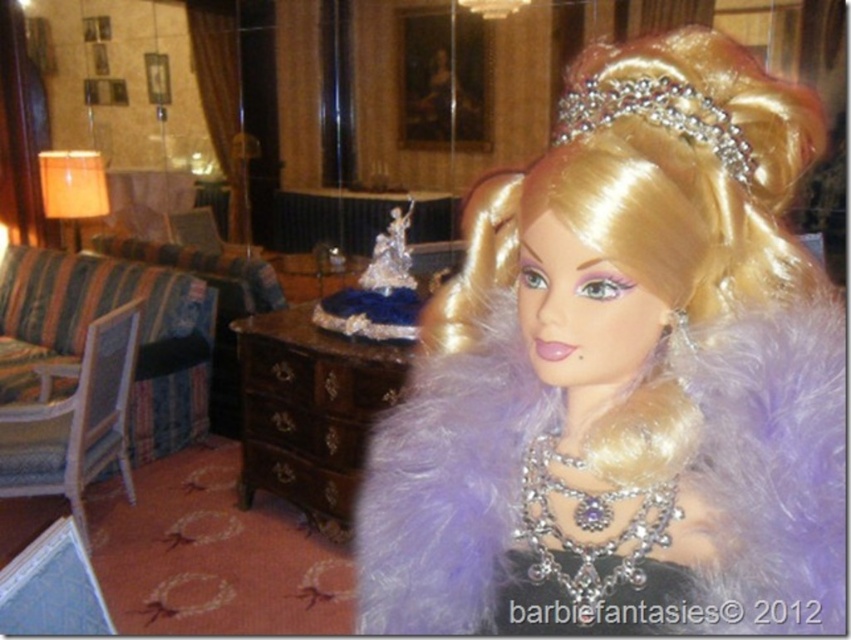
You are standing in the luxurious interior setting where the doll is displayed. There are two points marked in the image. The first point is at coordinates point (647, 317) and the second point is at point (660, 120). If you were to walk from the first point to the second point, would you be moving towards the doll or away from it?

Since point (647, 317) is behind point (660, 120), moving from the first point to the second point would mean moving towards the doll.

Consider the image. You are a guest at a party and need to sit down. You see a white wood armchair at left and a diamond encrusted tiara at upper center. Which object can you sit on?

The white wood armchair at left can be sat on, while the diamond encrusted tiara at upper center is an accessory and not meant for sitting. The white wood armchair at left is also wider than the tiara, making it suitable for sitting.

You are a photographer setting up a shoot in the room. You need to position a 1.2 meter tall light stand between the silky blonde wig at upper center and the white wood armchair at left. Can the light stand fit vertically between them without touching either object?

The silky blonde wig at upper center is not as tall as the white wood armchair at left, so the tallest object between them is the white wood armchair at left. Since the light stand is 1.2 meters tall, it can be placed vertically between them as long as the height of the white wood armchair at left is at least 1.2 meters. However, without knowing the exact height of the armchair, we cannot confirm if the light stand will fit without touching.